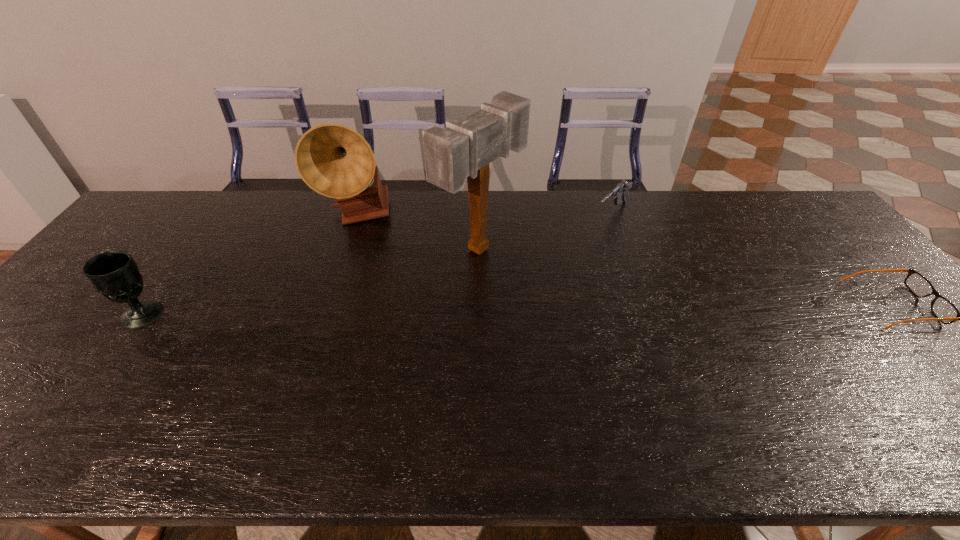
You are a GUI agent. You are given a task and a screenshot of the screen. Output one action in this format:
    pyautogui.click(x=<x>, y=<y>)
    Task: Click on the free space on the desktop that is between the chalice and the shortest object and is positioned at the head of the third object from right to left
    This screenshot has width=960, height=540.
    Given the screenshot: What is the action you would take?
    pyautogui.click(x=590, y=308)

This screenshot has height=540, width=960. What are the coordinates of `vacant spot on the desktop that is between the third tallest object and the spectacles and is positioned at the barrel of the second object from right to left` in the screenshot? It's located at (509, 309).

Image resolution: width=960 pixels, height=540 pixels. I want to click on vacant space on the desktop that is between the leftmost object and the spectacles and is positioned on the horn of the second object from left to right, so click(x=453, y=310).